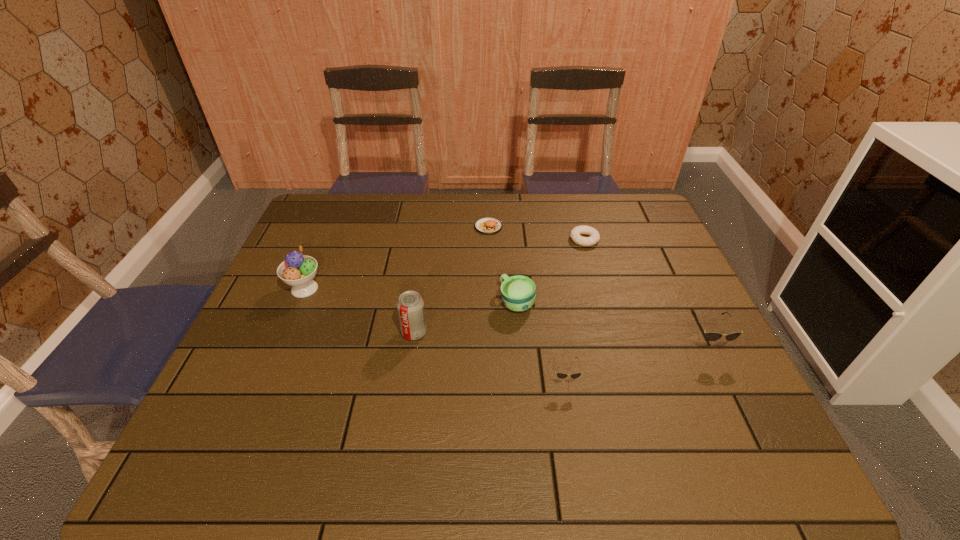
Where is `vacant point located between the right sunglasses and the cup`? vacant point located between the right sunglasses and the cup is located at coordinates (612, 322).

I want to click on free space between the soda can and the icecream, so click(x=359, y=310).

Identify the location of vacant area that lies between the nearest object and the soda can. Image resolution: width=960 pixels, height=540 pixels. (490, 355).

Find the location of a particular element. This screenshot has height=540, width=960. vacant area that lies between the leftmost object and the sixth object from right to left is located at coordinates (359, 310).

You are a GUI agent. You are given a task and a screenshot of the screen. Output one action in this format:
    pyautogui.click(x=<x>, y=<y>)
    Task: Click on the vacant point located between the cup and the soda can
    Image resolution: width=960 pixels, height=540 pixels.
    Given the screenshot: What is the action you would take?
    pyautogui.click(x=466, y=317)

You are a GUI agent. You are given a task and a screenshot of the screen. Output one action in this format:
    pyautogui.click(x=<x>, y=<y>)
    Task: Click on the vacant area between the icecream and the shorter sunglasses
    The image size is (960, 540).
    Given the screenshot: What is the action you would take?
    pyautogui.click(x=435, y=334)

The width and height of the screenshot is (960, 540). I want to click on free space between the taller sunglasses and the sixth object from left to right, so click(645, 291).

The width and height of the screenshot is (960, 540). What are the coordinates of `free spot between the icecream and the taller sunglasses` in the screenshot? It's located at (506, 316).

Choose which object is the second nearest neighbor to the left sunglasses. Please provide its 2D coordinates. Your answer should be formatted as a tuple, i.e. [(x, y)], where the tuple contains the x and y coordinates of a point satisfying the conditions above.

[(711, 336)]

Locate which object ranks in proximity to the farther sunglasses. Please provide its 2D coordinates. Your answer should be formatted as a tuple, i.e. [(x, y)], where the tuple contains the x and y coordinates of a point satisfying the conditions above.

[(560, 375)]